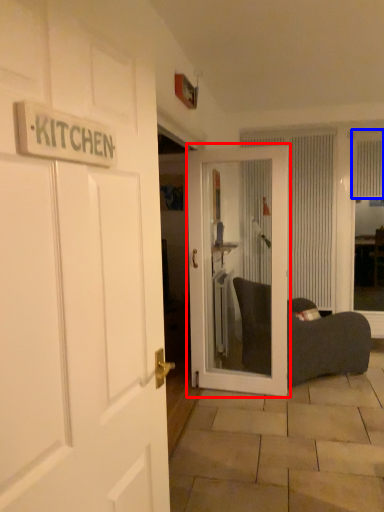
Question: Which of the following is the closest to the observer, door (highlighted by a red box) or curtain (highlighted by a blue box)?

Choices:
 (A) door
 (B) curtain

Answer: (A)